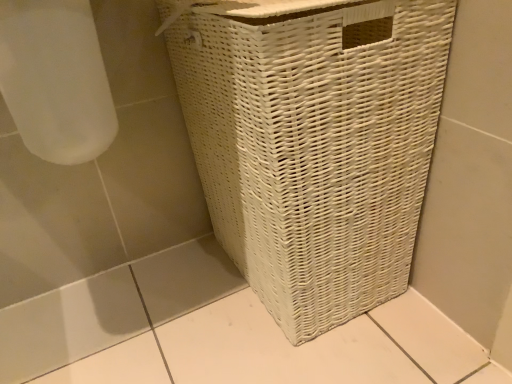
I want to click on white wicker basket at center, so click(x=313, y=142).

The image size is (512, 384). What do you see at coordinates (313, 142) in the screenshot?
I see `white wicker basket at center` at bounding box center [313, 142].

What are the coordinates of `white wicker basket at center` in the screenshot? It's located at (313, 142).